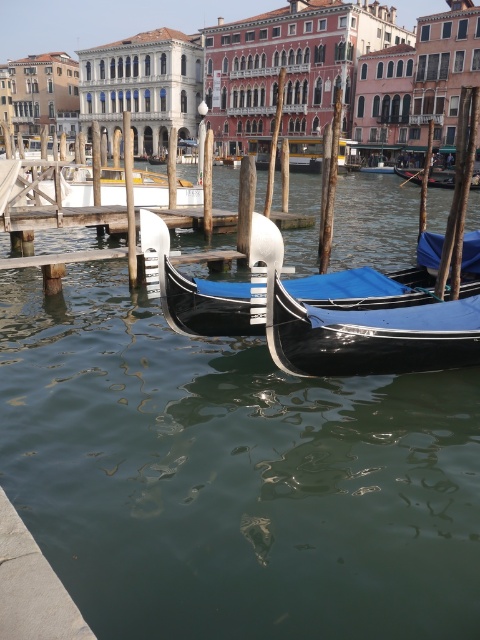
You are a tourist standing on the canal bridge and want to take a photo of both the shiny black gondola at center and the metallic silver gondola at center. Which gondola should you crouch down to get a better angle for the photo?

You should crouch down to take a photo of the shiny black gondola at center because it is shorter than the metallic silver gondola at center, allowing for a closer and more level perspective.

You are standing on the wooden post to the left of the gondola represented by point (304, 154). Which direction should you face to see the gondola?

You should face to the right to see the metallic silver gondola at center represented by point (304, 154).

You are a tourist standing on the canal bridge and see the metallic silver gondola at center and the blue fabric gondola at center. Which gondola is closer to you?

The metallic silver gondola at center is positioned over blue fabric gondola at center, so the metallic silver gondola at center is closer to you.